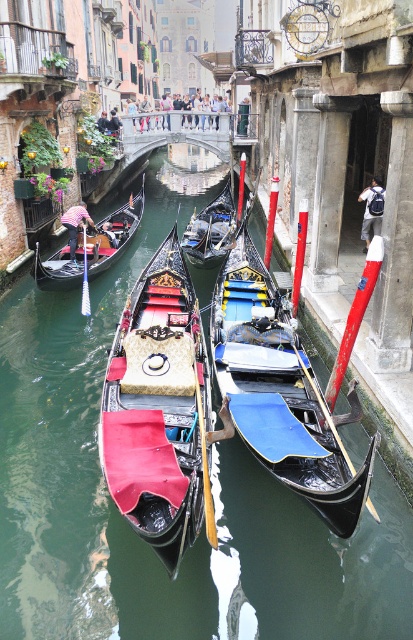
Who is more distant from viewer, (187, 538) or (263, 404)?

Positioned behind is point (263, 404).

Can you confirm if velvet red gondola at center is bigger than black polished wood gondola at center?

Incorrect, velvet red gondola at center is not larger than black polished wood gondola at center.

Between point (137, 422) and point (263, 369), which one is positioned behind?

The point (263, 369) is behind.

Locate an element on the screen. velvet red gondola at center is located at coordinates (159, 410).